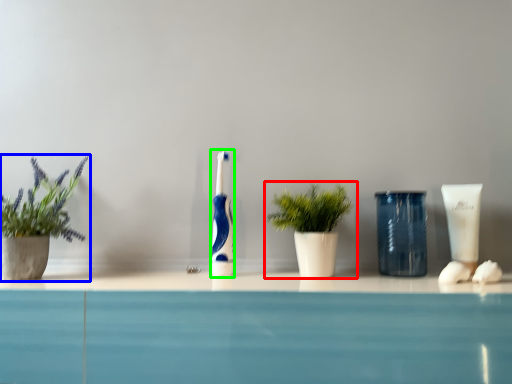
Question: Which object is the closest to the houseplant (highlighted by a red box)? Choose among these: houseplant (highlighted by a blue box) or toothbrush (highlighted by a green box).

Choices:
 (A) houseplant
 (B) toothbrush

Answer: (B)